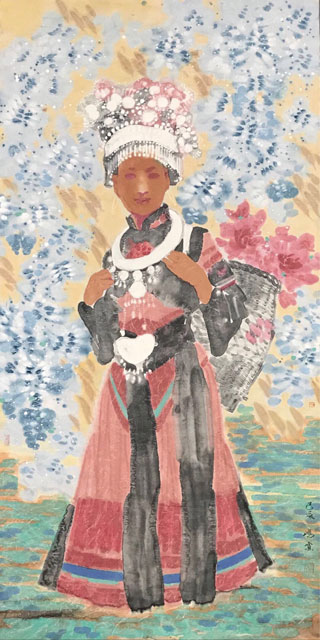
Locate an element on the screen. bottom left and right corners of a painting is located at coordinates (5, 636), (314, 635).